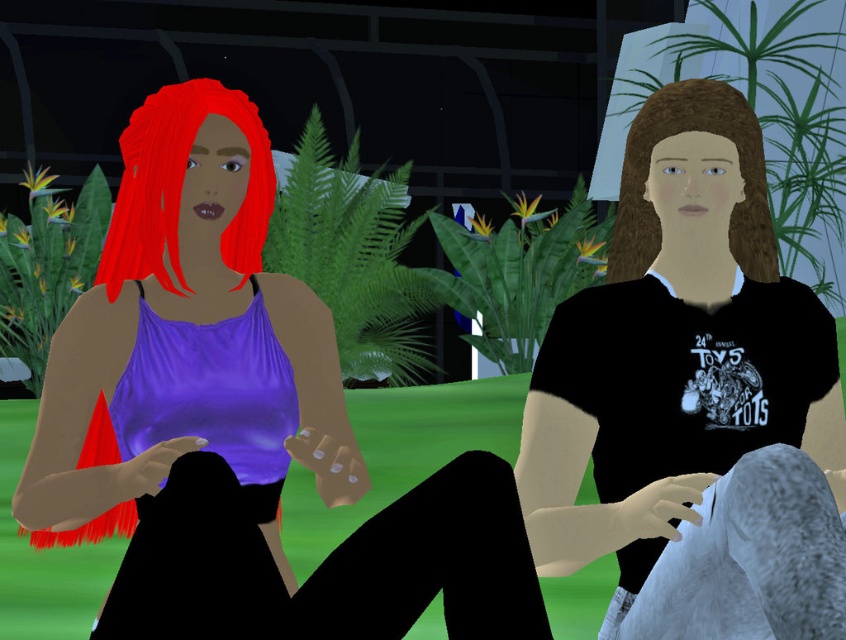
From the picture: You are a game developer designing a new level where two characters must interact. The shiny red hair at left and brown matte hair at center are positioned in the scene. If the game requires characters to be at least 4 feet apart for safety, is their current distance compliant with the safety requirement?

The distance between the shiny red hair at left and brown matte hair at center is 3.65 feet, which is less than the required 4 feet. Therefore, their current distance does not comply with the safety requirement.